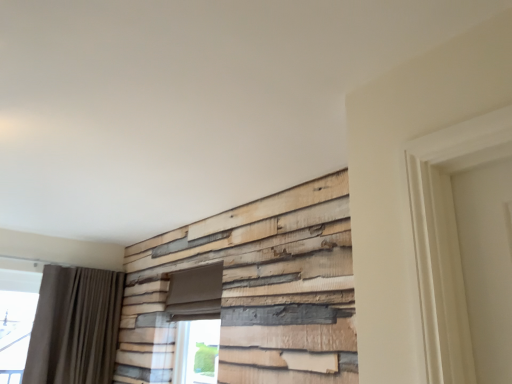
Question: Considering the positions of dark gray fabric curtain at left and green glass window at lower center in the image, is dark gray fabric curtain at left taller or shorter than green glass window at lower center?

Choices:
 (A) short
 (B) tall

Answer: (B)

Question: Choose the correct answer: Is dark gray fabric curtain at left inside green glass window at lower center or outside it?

Choices:
 (A) inside
 (B) outside

Answer: (B)

Question: From the image's perspective, is dark gray fabric curtain at left above or below green glass window at lower center?

Choices:
 (A) above
 (B) below

Answer: (A)

Question: Does point (217, 357) appear closer or farther from the camera than point (45, 309)?

Choices:
 (A) farther
 (B) closer

Answer: (B)

Question: From the image's perspective, is green glass window at lower center located above or below dark gray fabric curtain at left?

Choices:
 (A) below
 (B) above

Answer: (A)

Question: Is green glass window at lower center situated inside dark gray fabric curtain at left or outside?

Choices:
 (A) outside
 (B) inside

Answer: (A)

Question: From a real-world perspective, is green glass window at lower center positioned above or below dark gray fabric curtain at left?

Choices:
 (A) above
 (B) below

Answer: (B)